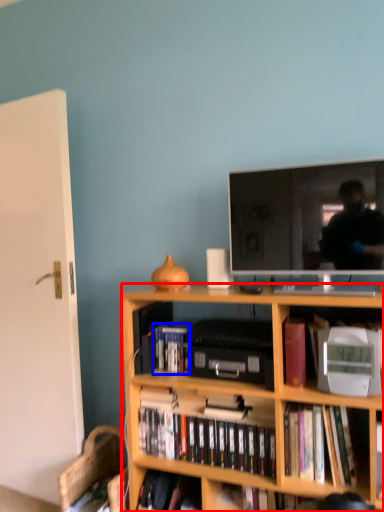
Question: Which object appears farthest to the camera in this image, bookcase (highlighted by a red box) or book (highlighted by a blue box)?

Choices:
 (A) bookcase
 (B) book

Answer: (B)